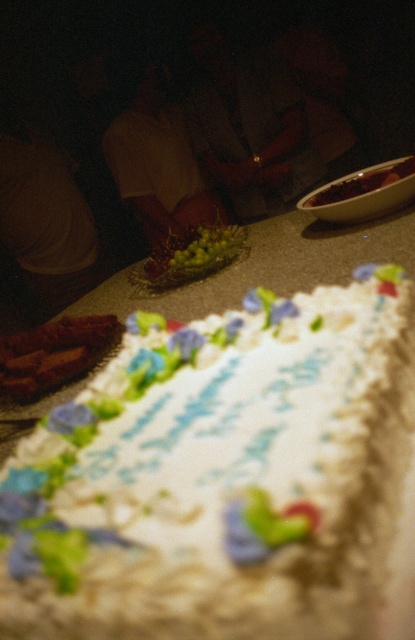
Question: Which point is closer to the camera?

Choices:
 (A) (173, 150)
 (B) (365, 189)
 (C) (270, 332)

Answer: (C)

Question: Which object is closer to the camera taking this photo?

Choices:
 (A) smokey brown meat at lower left
 (B) white frosted cake at center

Answer: (B)

Question: Can you confirm if white frosted cake at center is smaller than matte white shirt at center?

Choices:
 (A) no
 (B) yes

Answer: (B)

Question: Can you confirm if matte white shirt at center is positioned above green shiny grapes at center?

Choices:
 (A) yes
 (B) no

Answer: (A)

Question: Which point is closer to the camera?

Choices:
 (A) matte white shirt at center
 (B) smooth brown bowl at center

Answer: (B)

Question: Is smokey brown meat at lower left to the right of smooth brown bowl at center from the viewer's perspective?

Choices:
 (A) yes
 (B) no

Answer: (B)